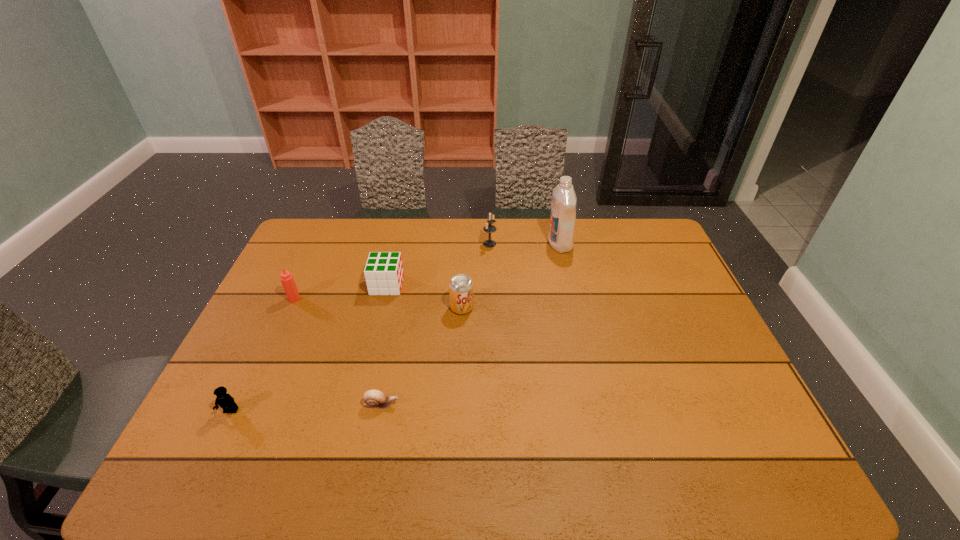
Identify the location of detergent. Image resolution: width=960 pixels, height=540 pixels. click(x=564, y=201).

The width and height of the screenshot is (960, 540). Find the location of `the rightmost object`. the rightmost object is located at coordinates (564, 201).

You are a GUI agent. You are given a task and a screenshot of the screen. Output one action in this format:
    pyautogui.click(x=<x>, y=<y>)
    Task: Click on the sixth object from left to right
    The width and height of the screenshot is (960, 540).
    Given the screenshot: What is the action you would take?
    pyautogui.click(x=489, y=228)

Identify the location of Tabasco sauce. The image size is (960, 540). (287, 280).

The width and height of the screenshot is (960, 540). I want to click on pop (soda), so click(460, 286).

Image resolution: width=960 pixels, height=540 pixels. In order to click on cube in this screenshot , I will do `click(383, 272)`.

Find the location of a particular element. The image size is (960, 540). the second shortest object is located at coordinates (225, 401).

The width and height of the screenshot is (960, 540). In order to click on escargot in this screenshot , I will do `click(373, 398)`.

Image resolution: width=960 pixels, height=540 pixels. What are the coordinates of `vacant space located 0.290m on the front of the detergent` in the screenshot? It's located at (576, 315).

I want to click on free space located on the right of the second object from right to left, so click(x=543, y=244).